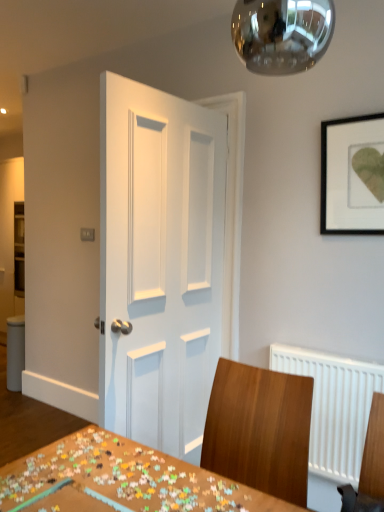
Question: Relative to wooden puzzle pieces at center, is white painted wood door at center in front or behind?

Choices:
 (A) front
 (B) behind

Answer: (B)

Question: Does point (218, 334) appear closer or farther from the camera than point (21, 471)?

Choices:
 (A) farther
 (B) closer

Answer: (A)

Question: Which is nearer to the white painted wood door at center?

Choices:
 (A) black matte picture frame at upper right
 (B) wooden chair at center
 (C) wooden puzzle pieces at center

Answer: (B)

Question: Which object is positioned closest to the wooden chair at center?

Choices:
 (A) white painted wood door at center
 (B) wooden puzzle pieces at center
 (C) black matte picture frame at upper right

Answer: (B)